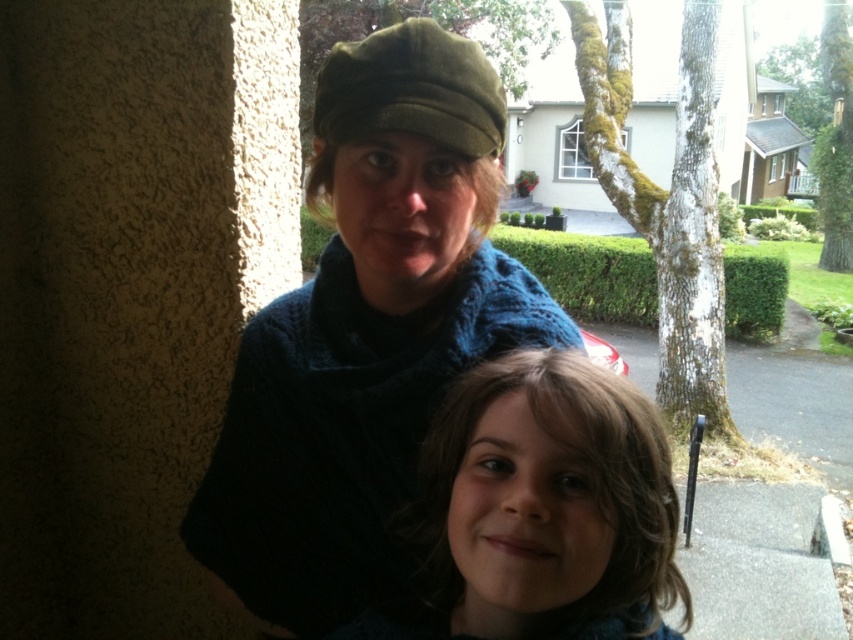
Does knitted dark blue sweater at center have a greater width compared to brown curly hair at lower center?

Yes, knitted dark blue sweater at center is wider than brown curly hair at lower center.

Between knitted dark blue sweater at center and brown curly hair at lower center, which one is positioned higher?

knitted dark blue sweater at center is above.

The width and height of the screenshot is (853, 640). Identify the location of knitted dark blue sweater at center. (366, 332).

Where is `knitted dark blue sweater at center`? The width and height of the screenshot is (853, 640). knitted dark blue sweater at center is located at coordinates (366, 332).